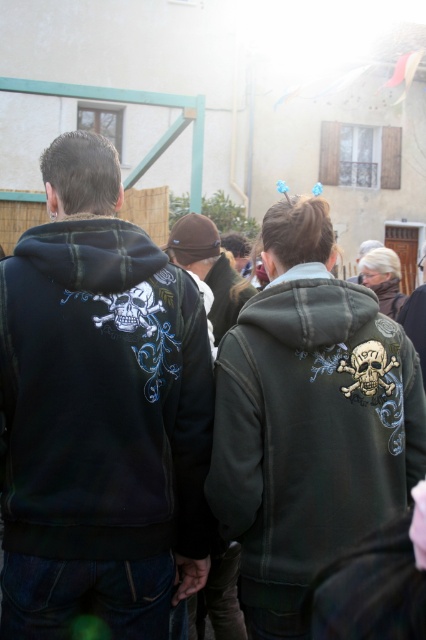
Question: Which point is farther to the camera?

Choices:
 (A) black matte hoodie at left
 (B) brown woolen hat at center

Answer: (B)

Question: Considering the real-world distances, which object is closest to the brown woolen hat at center?

Choices:
 (A) dark green hoodie with skull design at center
 (B) black matte hoodie at left

Answer: (A)

Question: Does black matte hoodie at left have a lesser width compared to dark green hoodie with skull design at center?

Choices:
 (A) no
 (B) yes

Answer: (B)

Question: Which point is closer to the camera taking this photo?

Choices:
 (A) (77, 509)
 (B) (172, 248)
 (C) (331, 404)

Answer: (A)

Question: Considering the relative positions of black matte hoodie at left and brown woolen hat at center in the image provided, where is black matte hoodie at left located with respect to brown woolen hat at center?

Choices:
 (A) below
 (B) above

Answer: (A)

Question: Does dark green hoodie with skull design at center appear on the right side of brown woolen hat at center?

Choices:
 (A) no
 (B) yes

Answer: (B)